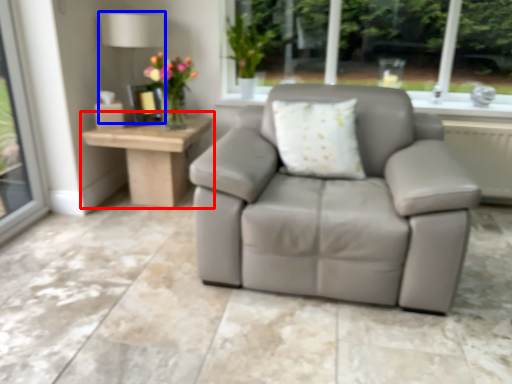
Question: Which object is further to the camera taking this photo, table (highlighted by a red box) or lamp (highlighted by a blue box)?

Choices:
 (A) table
 (B) lamp

Answer: (B)